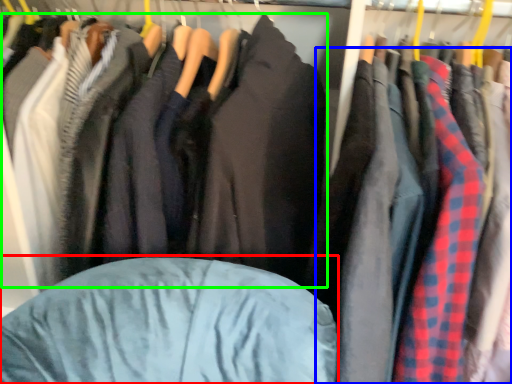
Question: Based on their relative distances, which object is nearer to bean bag chair (highlighted by a red box)? Choose from clothing (highlighted by a blue box) and jacket (highlighted by a green box).

Choices:
 (A) clothing
 (B) jacket

Answer: (B)